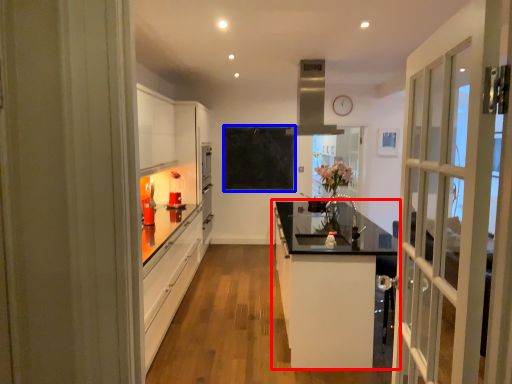
Question: Which object appears closest to the camera in this image, cabinetry (highlighted by a red box) or bulletin board (highlighted by a blue box)?

Choices:
 (A) cabinetry
 (B) bulletin board

Answer: (A)